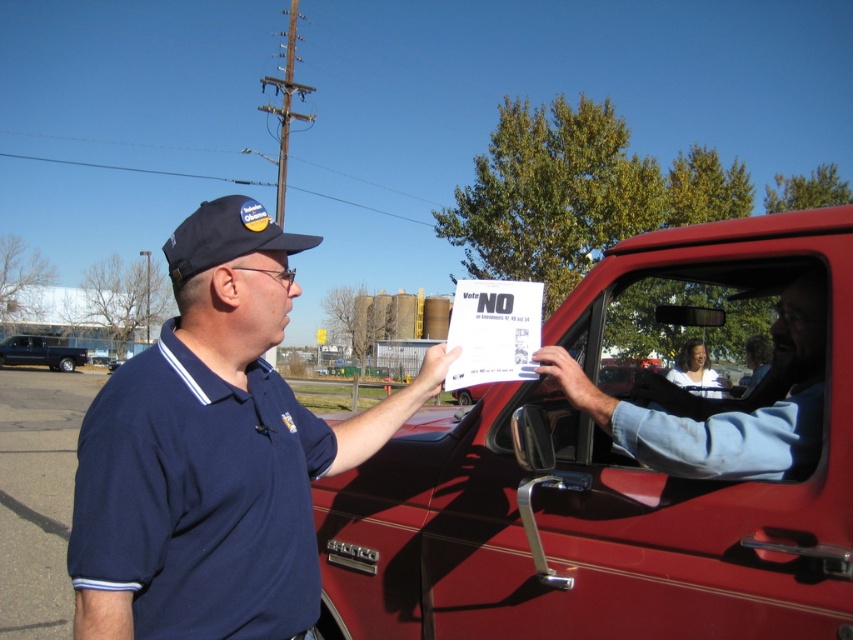
Question: Which object appears farthest from the camera in this image?

Choices:
 (A) metallic red truck at center
 (B) dark blue fabric baseball cap at upper left

Answer: (A)

Question: Can you confirm if metallic red truck at center is positioned to the left of dark blue fabric baseball cap at upper left?

Choices:
 (A) no
 (B) yes

Answer: (A)

Question: Can you confirm if matte blue shirt at center is positioned to the right of denim shirt at center?

Choices:
 (A) yes
 (B) no

Answer: (B)

Question: Is metallic red truck at center below black matte van at left?

Choices:
 (A) yes
 (B) no

Answer: (B)

Question: Among these objects, which one is nearest to the camera?

Choices:
 (A) denim shirt at center
 (B) black matte van at left
 (C) dark blue fabric baseball cap at upper left
 (D) matte blue shirt at center

Answer: (D)

Question: Estimate the real-world distances between objects in this image. Which object is farther from the matte blue shirt at center?

Choices:
 (A) dark blue fabric baseball cap at upper left
 (B) metallic red truck at center
 (C) black matte van at left

Answer: (C)